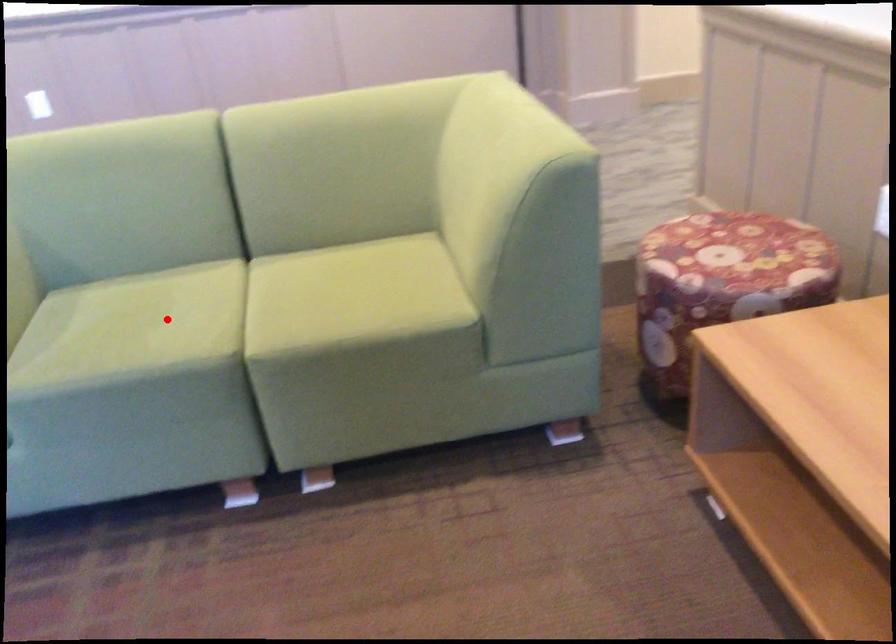
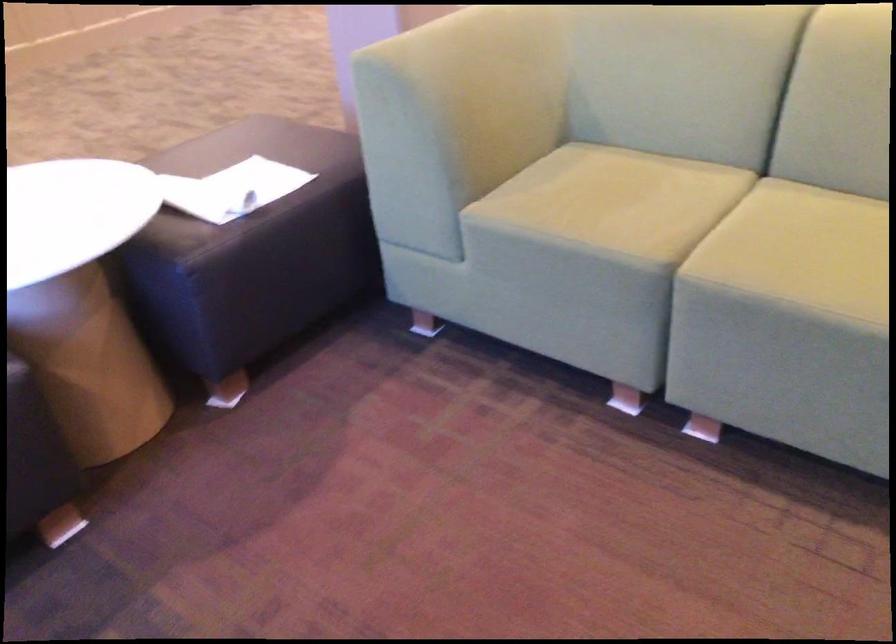
The point at the highlighted location is marked in the first image. Where is the corresponding point in the second image?

(636, 202)